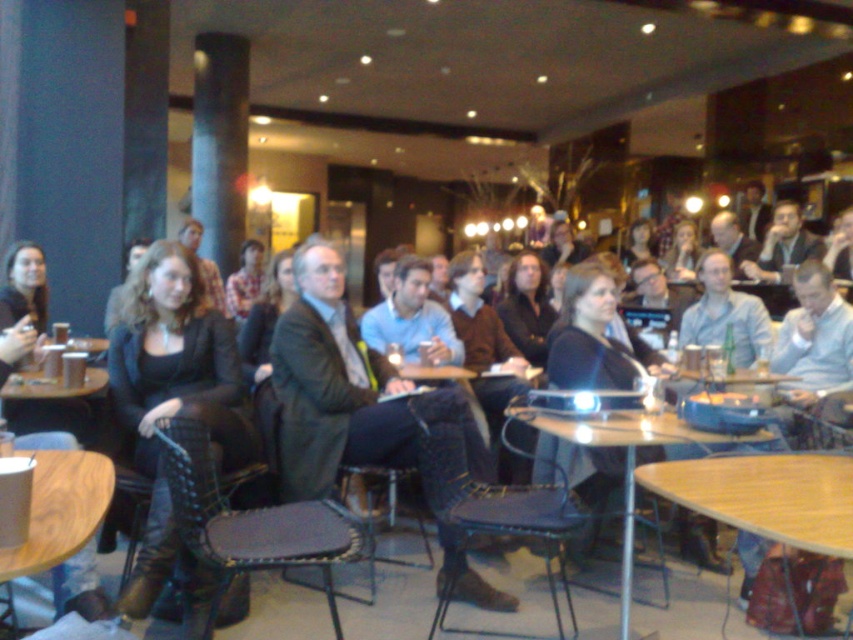
Question: Is light wood round table at lower right positioned in front of dark blue fabric chair at center?

Choices:
 (A) yes
 (B) no

Answer: (A)

Question: Which of the following is the closest to the observer?

Choices:
 (A) wooden table at lower left
 (B) matte black jacket at center
 (C) leather boots at center

Answer: (A)

Question: Which object is farther from the camera taking this photo?

Choices:
 (A) matte black jacket at center
 (B) wooden round table at center
 (C) leather boots at center
 (D) light wood round table at lower right

Answer: (A)

Question: Based on their relative distances, which object is farther from the matte black jacket at center?

Choices:
 (A) leather boots at center
 (B) black woven chair at center

Answer: (A)

Question: Considering the relative positions of leather boots at center and light wood round table at lower right in the image provided, where is leather boots at center located with respect to light wood round table at lower right?

Choices:
 (A) left
 (B) right

Answer: (A)

Question: In this image, where is wooden round table at center located relative to wooden table at lower left?

Choices:
 (A) below
 (B) above

Answer: (A)